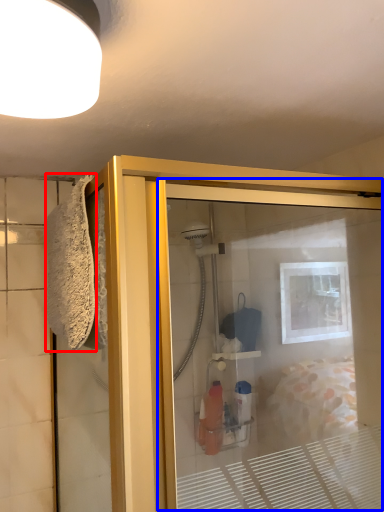
Question: Which object is further to the camera taking this photo, bath towel (highlighted by a red box) or screen door (highlighted by a blue box)?

Choices:
 (A) bath towel
 (B) screen door

Answer: (A)